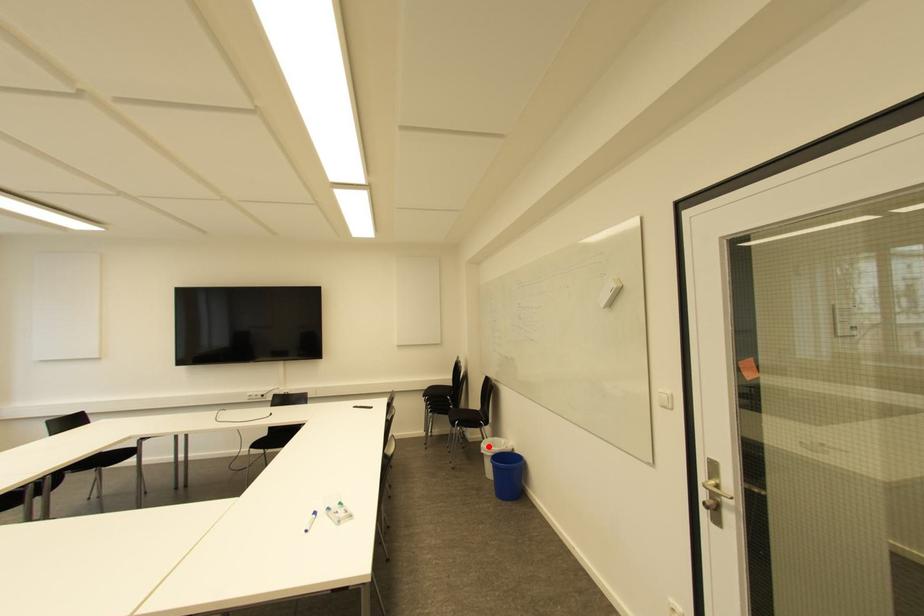
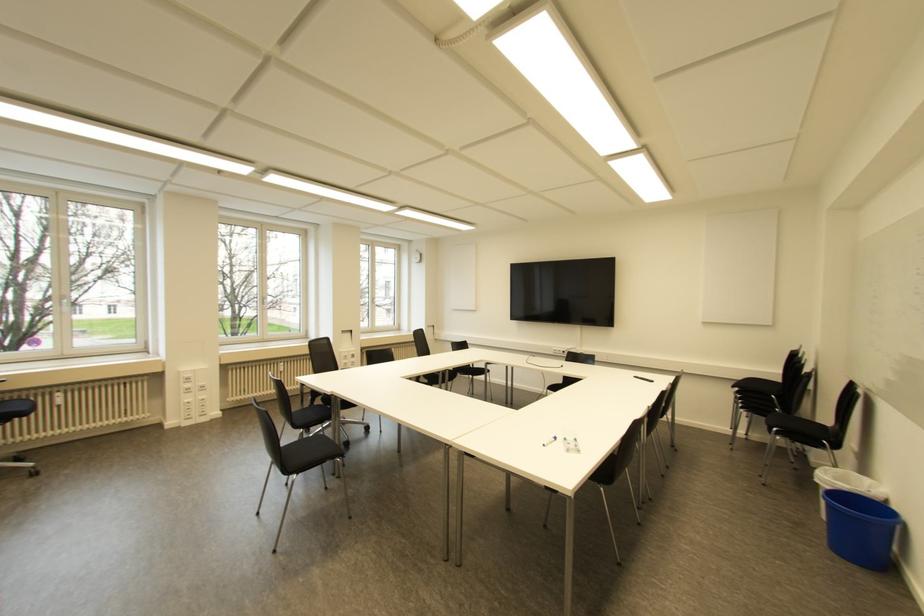
Find the pixel in the second image that matches the highlighted location in the first image.

(829, 477)